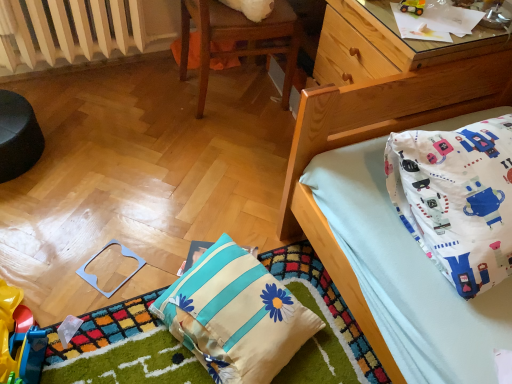
Question: Is white fabric pillow with blue stripes and flower design at lower center, positioned as the 2th pillow in right-to-left order, wider than white painted metal radiator at upper left?

Choices:
 (A) no
 (B) yes

Answer: (B)

Question: Can you confirm if white fabric pillow with blue stripes and flower design at lower center, which is counted as the 1th pillow, starting from the left, is positioned to the left of white painted metal radiator at upper left?

Choices:
 (A) no
 (B) yes

Answer: (A)

Question: Can you see white fabric pillow with blue stripes and flower design at lower center, which is counted as the 1th pillow, starting from the left, touching white painted metal radiator at upper left?

Choices:
 (A) no
 (B) yes

Answer: (A)

Question: From a real-world perspective, is white fabric pillow with blue stripes and flower design at lower center, which is counted as the 1th pillow, starting from the left, physically below white painted metal radiator at upper left?

Choices:
 (A) no
 (B) yes

Answer: (B)

Question: From the image's perspective, would you say white fabric pillow with blue stripes and flower design at lower center, which is counted as the 1th pillow, starting from the left, is positioned over white painted metal radiator at upper left?

Choices:
 (A) no
 (B) yes

Answer: (A)

Question: Considering the relative positions of white fabric pillow with blue stripes and flower design at lower center, which is counted as the 1th pillow, starting from the left, and white painted metal radiator at upper left in the image provided, is white fabric pillow with blue stripes and flower design at lower center, which is counted as the 1th pillow, starting from the left, behind white painted metal radiator at upper left?

Choices:
 (A) no
 (B) yes

Answer: (A)

Question: Considering the relative positions of wooden chair at upper center and light blue plastic square at lower left, which is counted as the second toy, starting from the top, in the image provided, is wooden chair at upper center to the right of light blue plastic square at lower left, which is counted as the second toy, starting from the top, from the viewer's perspective?

Choices:
 (A) yes
 (B) no

Answer: (A)

Question: Is wooden chair at upper center shorter than light blue plastic square at lower left, which is counted as the second toy, starting from the top?

Choices:
 (A) no
 (B) yes

Answer: (A)

Question: Considering the relative sizes of wooden chair at upper center and light blue plastic square at lower left, which is the second toy in right-to-left order, in the image provided, is wooden chair at upper center taller than light blue plastic square at lower left, which is the second toy in right-to-left order,?

Choices:
 (A) yes
 (B) no

Answer: (A)

Question: Is wooden chair at upper center in front of light blue plastic square at lower left, which is counted as the second toy, starting from the top?

Choices:
 (A) yes
 (B) no

Answer: (B)

Question: Is wooden chair at upper center touching light blue plastic square at lower left, which is the second toy in right-to-left order?

Choices:
 (A) no
 (B) yes

Answer: (A)

Question: Considering the relative positions of wooden chair at upper center and light blue plastic square at lower left, which is the 2th toy from bottom to top, in the image provided, is wooden chair at upper center to the left of light blue plastic square at lower left, which is the 2th toy from bottom to top, from the viewer's perspective?

Choices:
 (A) no
 (B) yes

Answer: (A)

Question: Considering the relative sizes of rubberized plastic toy at lower left, placed as the 3th toy when sorted from top to bottom, and light blue plastic square at lower left, which is the 2th toy from bottom to top, in the image provided, is rubberized plastic toy at lower left, placed as the 3th toy when sorted from top to bottom, wider than light blue plastic square at lower left, which is the 2th toy from bottom to top,?

Choices:
 (A) no
 (B) yes

Answer: (A)